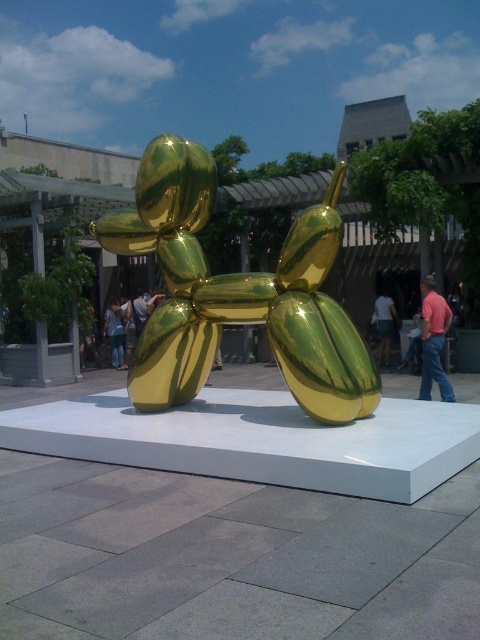
Question: Which object is farther from the camera taking this photo?

Choices:
 (A) white cotton shirt at center
 (B) gold metallic balloon dog at center

Answer: (A)

Question: Observing the image, what is the correct spatial positioning of pink cotton shirt at center in reference to denim pants at lower left?

Choices:
 (A) left
 (B) right

Answer: (B)

Question: Is gold metallic balloon dog at center smaller than white cotton shirt at center?

Choices:
 (A) no
 (B) yes

Answer: (A)

Question: Among these points, which one is farthest from the camera?

Choices:
 (A) coord(348,397)
 (B) coord(107,317)

Answer: (B)

Question: Is gold metallic balloon dog at center below denim pants at lower left?

Choices:
 (A) yes
 (B) no

Answer: (B)

Question: Which point appears closest to the camera in this image?

Choices:
 (A) (124, 364)
 (B) (377, 324)

Answer: (B)